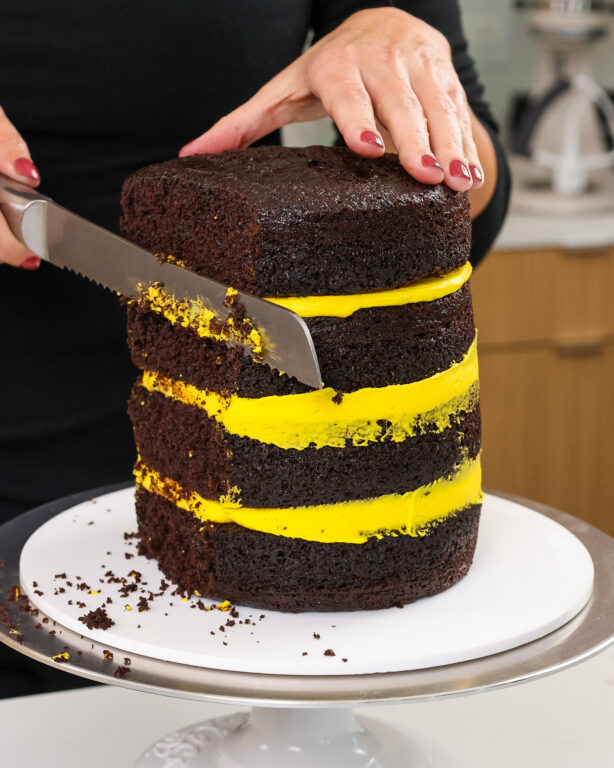
I want to click on table, so click(x=586, y=753).